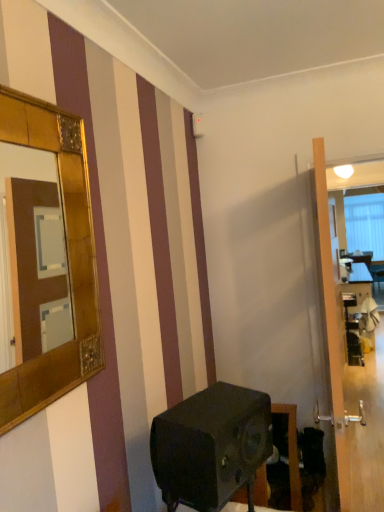
Question: In the image, is transparent glass door at right positioned in front of or behind matte black speaker at lower center?

Choices:
 (A) behind
 (B) front

Answer: (A)

Question: Is transparent glass door at right to the left or to the right of matte black speaker at lower center in the image?

Choices:
 (A) right
 (B) left

Answer: (A)

Question: Considering the real-world distances, which object is closest to the gold textured mirror at upper left?

Choices:
 (A) transparent glass door at right
 (B) matte black speaker at lower center

Answer: (B)

Question: Considering the real-world distances, which object is closest to the gold textured mirror at upper left?

Choices:
 (A) transparent glass door at right
 (B) matte black speaker at lower center

Answer: (B)